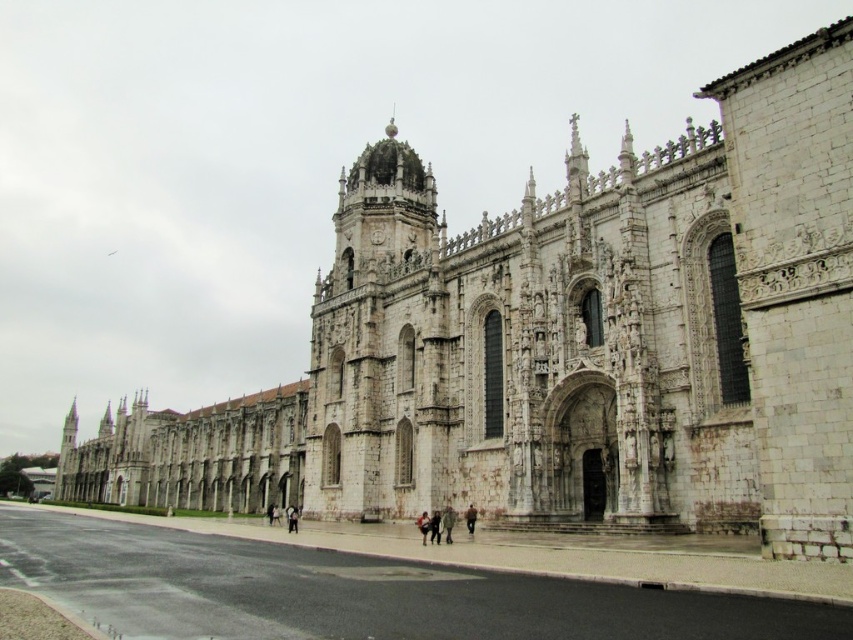
Between point (451, 525) and point (430, 520), which one is positioned behind?

Positioned behind is point (430, 520).

Is dark gray fabric coat at center further to camera compared to dark brown leather jacket at lower center?

No, dark gray fabric coat at center is in front of dark brown leather jacket at lower center.

Between point (445, 529) and point (430, 518), which one is positioned in front?

Point (445, 529) is more forward.

The image size is (853, 640). Identify the location of dark gray fabric coat at center. (447, 522).

Consider the image. Who is positioned more to the right, dark gray fabric coat at lower center or brown leather jacket at lower center?

Positioned to the right is brown leather jacket at lower center.

Is point (287, 518) more distant than point (468, 525)?

Yes.

Is point (292, 529) positioned after point (473, 518)?

Yes.

This screenshot has height=640, width=853. In order to click on dark gray fabric coat at lower center in this screenshot , I will do `click(292, 518)`.

This screenshot has width=853, height=640. I want to click on dark gray fabric coat at center, so click(447, 522).

Is point (450, 515) positioned before point (289, 512)?

Yes, it is.

Describe the element at coordinates (447, 522) in the screenshot. I see `dark gray fabric coat at center` at that location.

Locate an element on the screen. This screenshot has width=853, height=640. dark gray fabric coat at center is located at coordinates (447, 522).